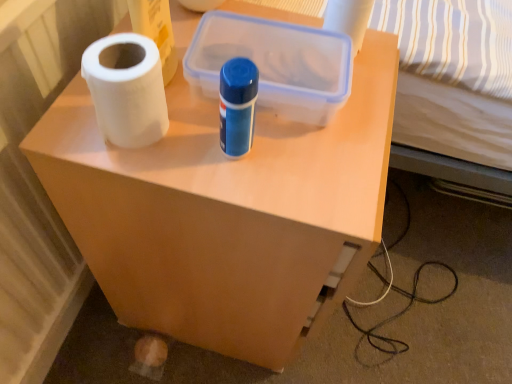
Question: Can you confirm if white matte toilet paper at upper center is thinner than matte plastic side table at center?

Choices:
 (A) yes
 (B) no

Answer: (A)

Question: From the image's perspective, is white matte toilet paper at upper center under matte plastic side table at center?

Choices:
 (A) yes
 (B) no

Answer: (B)

Question: Is white matte toilet paper at upper center oriented towards matte plastic side table at center?

Choices:
 (A) yes
 (B) no

Answer: (B)

Question: Is white matte toilet paper at upper center to the left of matte plastic side table at center from the viewer's perspective?

Choices:
 (A) yes
 (B) no

Answer: (B)

Question: Would you say white matte toilet paper at upper center contains matte plastic side table at center?

Choices:
 (A) yes
 (B) no

Answer: (B)

Question: Does white matte toilet paper at upper center have a greater width compared to matte plastic side table at center?

Choices:
 (A) yes
 (B) no

Answer: (B)

Question: Is white matte paper towel at left wider than white matte toilet paper at upper center?

Choices:
 (A) yes
 (B) no

Answer: (A)

Question: Is white matte paper towel at left not close to white matte toilet paper at upper center?

Choices:
 (A) yes
 (B) no

Answer: (B)

Question: Is the position of white matte paper towel at left more distant than that of white matte toilet paper at upper center?

Choices:
 (A) yes
 (B) no

Answer: (B)

Question: From a real-world perspective, is white matte paper towel at left physically below white matte toilet paper at upper center?

Choices:
 (A) yes
 (B) no

Answer: (B)

Question: Can you confirm if white matte paper towel at left is smaller than white matte toilet paper at upper center?

Choices:
 (A) no
 (B) yes

Answer: (A)

Question: Does white matte paper towel at left touch white matte toilet paper at upper center?

Choices:
 (A) yes
 (B) no

Answer: (B)

Question: Is matte plastic side table at center closer to camera compared to transparent plastic storage box at center?

Choices:
 (A) yes
 (B) no

Answer: (A)